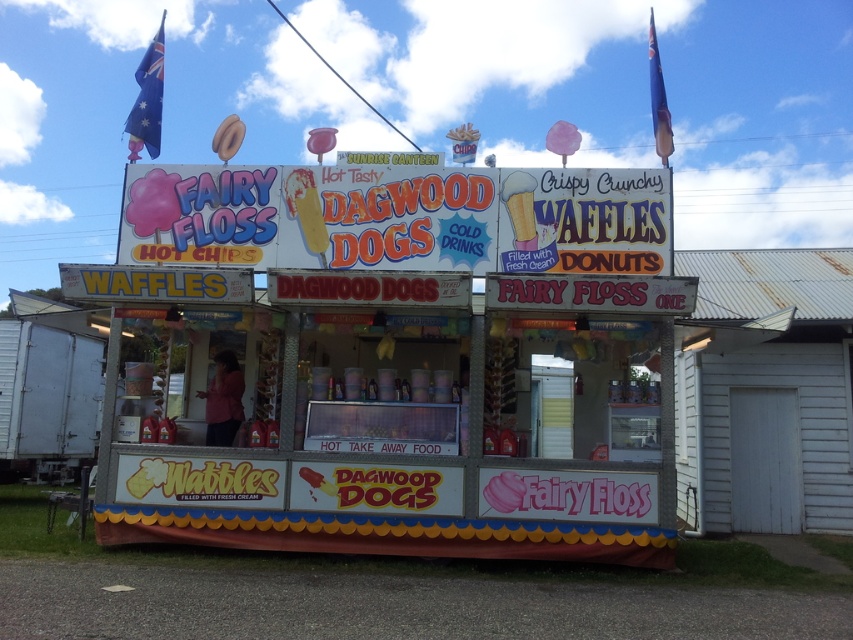
You are a customer standing at the entrance of the Sunrise Canteen food stall. You need to buy a ticket to order your food. Where should you go first, the matte plastic ticket booth at center or the metallic silver trailer at lower left?

The matte plastic ticket booth at center is the correct place to buy tickets since it is larger in size compared to the metallic silver trailer at lower left, indicating it is the main ticketing area.

You are a food stall worker who needs to move a heavy box from the metallic silver trailer at lower left to the matte plastic ticket booth at center. The box weighs 20 kg and you can carry it for 5 meters before needing a rest. How many times will you need to rest during this task?

The distance between the matte plastic ticket booth at center and the metallic silver trailer at lower left is 5.99 meters. Since you can carry the 20 kg box for 5 meters before needing a rest, you will need to rest once during the 5.99 meter journey.

You are a customer at the Sunrise Canteen food stall. You see the metallic silver trailer at lower left and the pink cotton candy at center. Which object is positioned higher from the ground?

The metallic silver trailer at lower left is located above the pink cotton candy at center, so it is positioned higher from the ground.